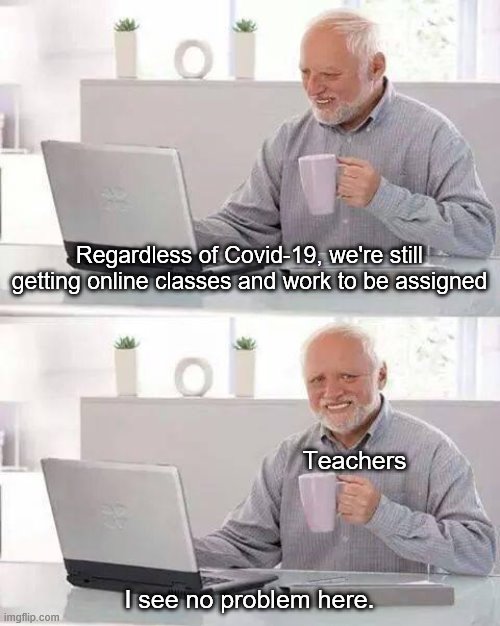
At what (x,y) coordinates should I click in order to perform the action: click on succulents. Please return your answer as a coordinate pair (x, y). Looking at the image, I should click on (128, 19), (121, 345), (243, 342), (243, 27).